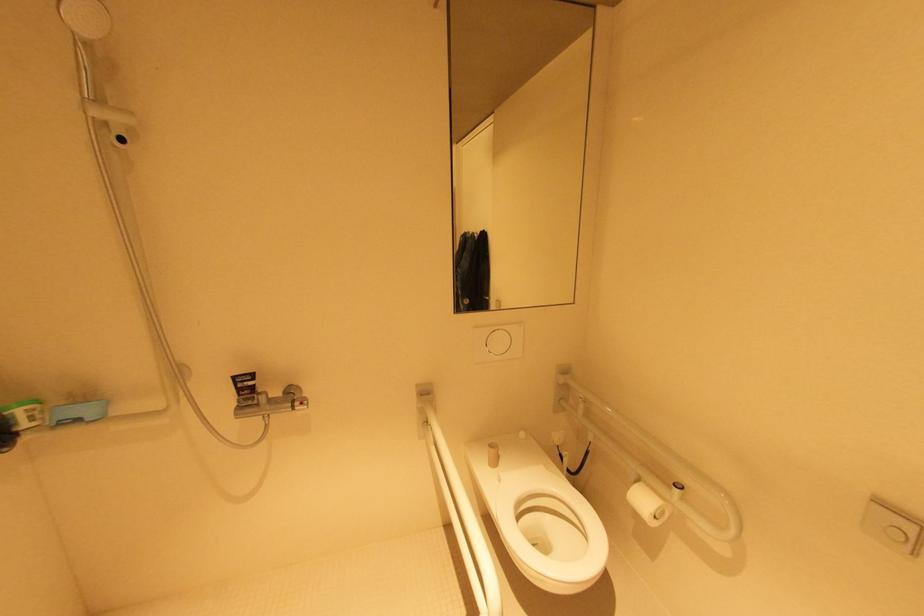
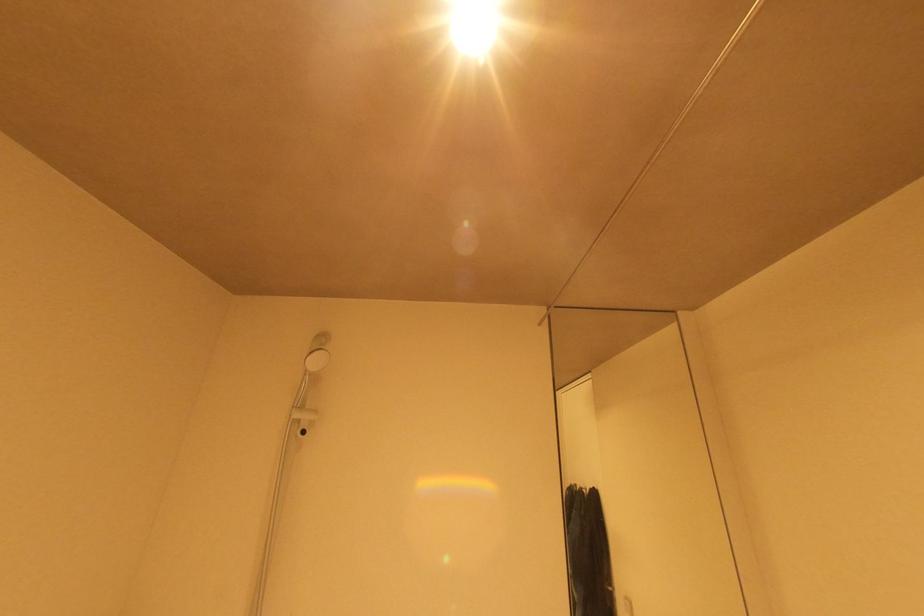
The images are taken continuously from a first-person perspective. In which direction is your viewpoint rotating?

The camera rotated toward left-up.